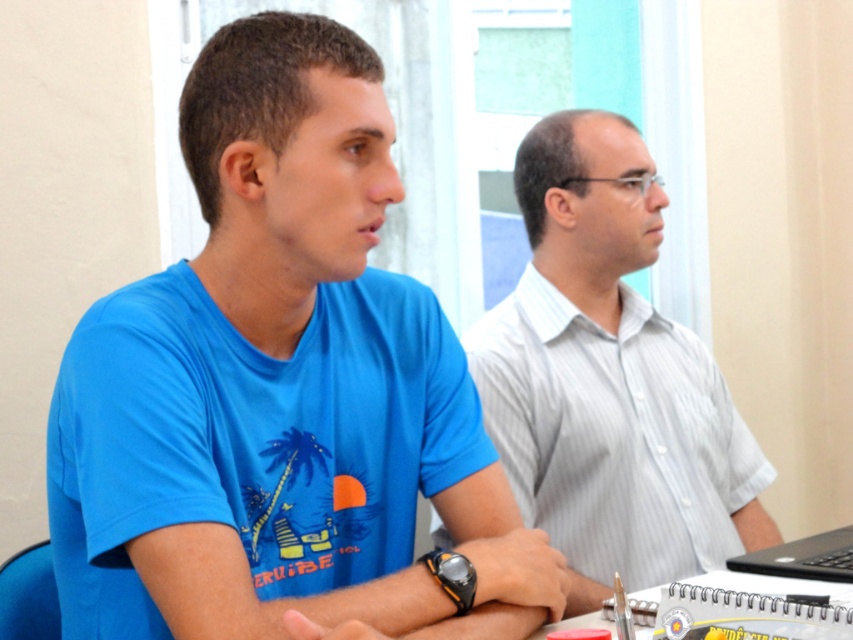
Is blue cotton shirt at center shorter than white striped shirt at center?

Yes, blue cotton shirt at center is shorter than white striped shirt at center.

Is point (379, 540) farther from viewer compared to point (688, 381)?

No, it is not.

Is point (143, 308) closer to camera compared to point (764, 531)?

Yes, point (143, 308) is in front of point (764, 531).

Locate an element on the screen. This screenshot has height=640, width=853. blue cotton shirt at center is located at coordinates (281, 388).